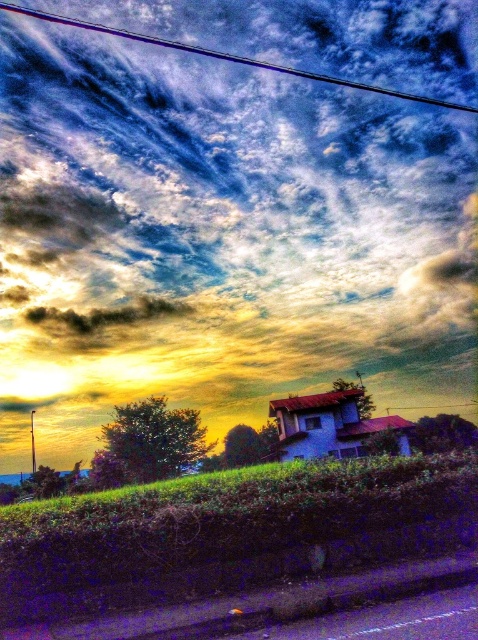
Question: Does cloudy sky at upper center appear over metallic wire at upper center?

Choices:
 (A) yes
 (B) no

Answer: (B)

Question: Which object is farther from the camera taking this photo?

Choices:
 (A) metallic wire at upper center
 (B) cloudy sky at upper center

Answer: (B)

Question: Is cloudy sky at upper center to the left of metallic wire at upper center from the viewer's perspective?

Choices:
 (A) no
 (B) yes

Answer: (A)

Question: Is cloudy sky at upper center thinner than metallic wire at upper center?

Choices:
 (A) no
 (B) yes

Answer: (A)